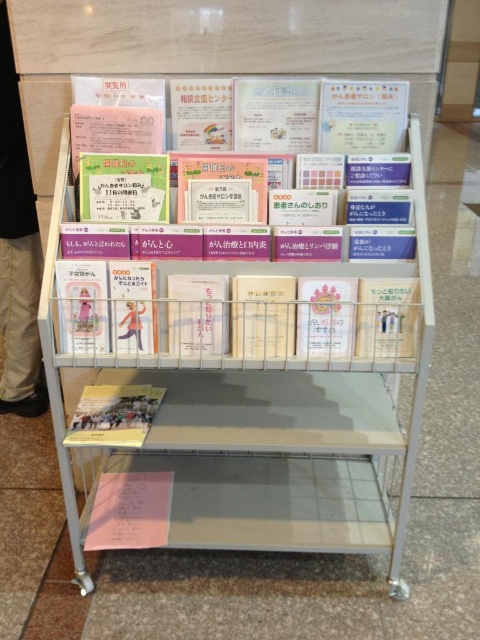
You are organizing the books on the top shelf of the metal book display stand. You have a matte plastic book at center and a white paper book at right. Which book should you place on the left side if you want the wider book to be on the left?

The matte plastic book at center might be wider than white paper book at right, so you should place the matte plastic book at center on the left side to have the wider book there.

You are organizing the top shelf of the metal book display stand. You need to place both the matte plastic book at center and the white paper book at right. Since the shelf has limited space, which book should you move to the bottom shelf to make room?

The matte plastic book at center is bigger than the white paper book at right, so you should move the matte plastic book at center to the bottom shelf to free up space on the top shelf.

You are a visitor at the library and see the metallic white bookshelf at center and the yellow paper book at lower left. Which one is positioned higher in the image?

The metallic white bookshelf at center is positioned higher than the yellow paper book at lower left.